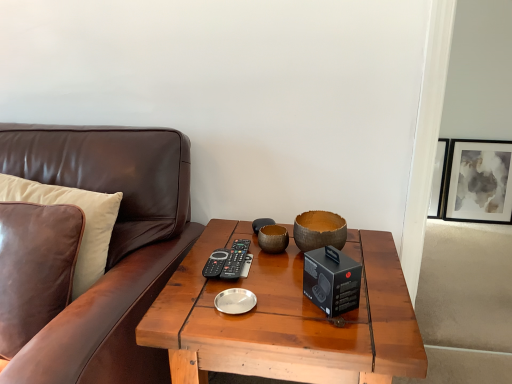
You are a GUI agent. You are given a task and a screenshot of the screen. Output one action in this format:
    pyautogui.click(x=<x>, y=<y>)
    Task: Click on the vacant area that is situated to the right of natural wood bowl at center
    The height and width of the screenshot is (384, 512).
    Given the screenshot: What is the action you would take?
    pyautogui.click(x=371, y=251)